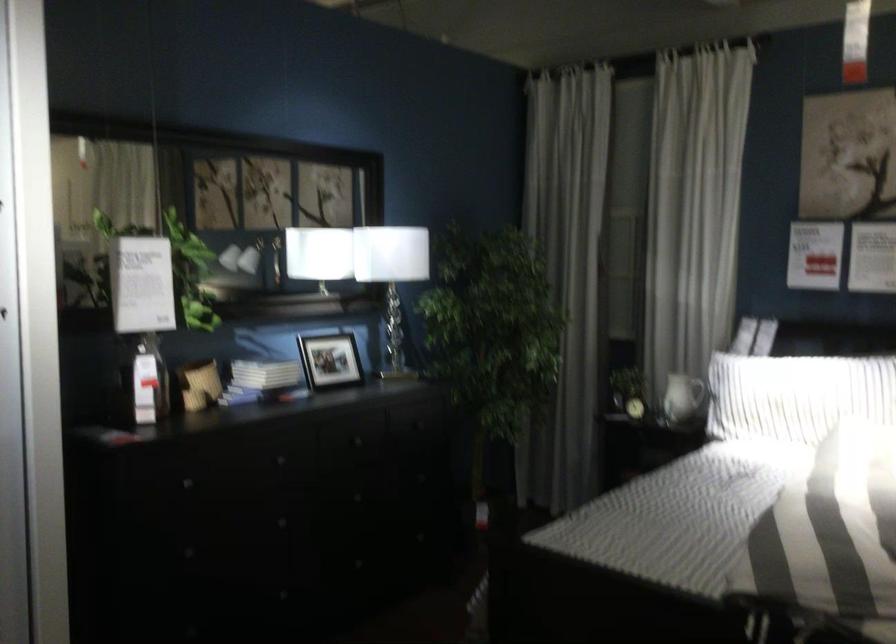
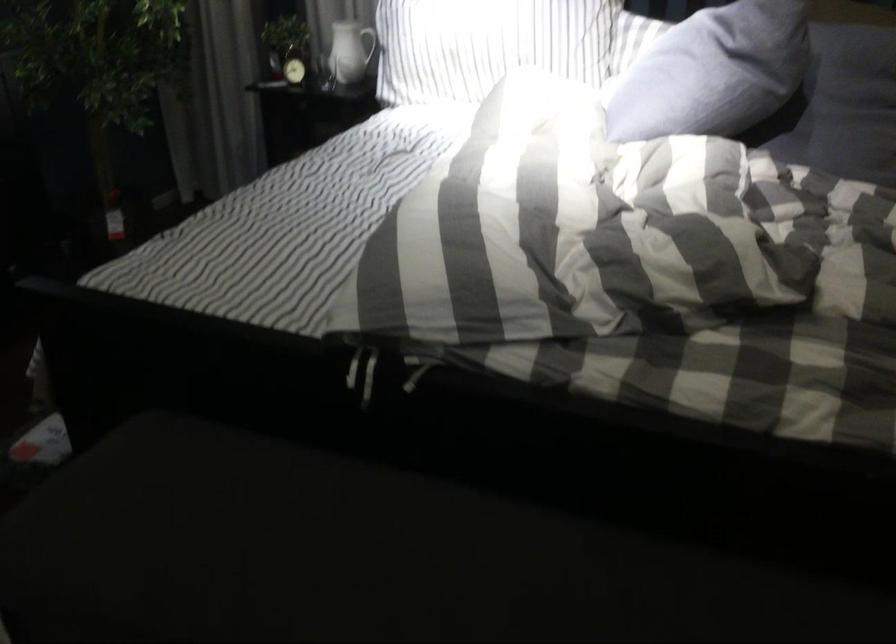
Where in the second image is the point corresponding to point 708,383 from the first image?

(371, 44)